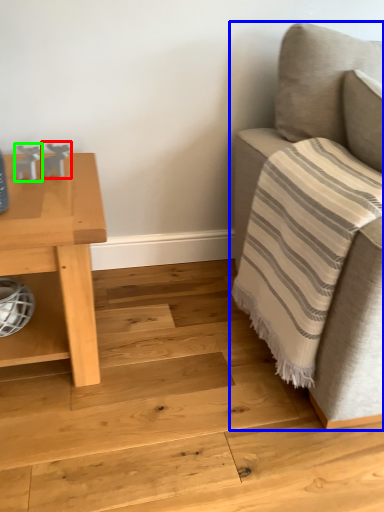
Question: Based on their relative distances, which object is farther from toy (highlighted by a red box)? Choose from studio couch (highlighted by a blue box) and toy (highlighted by a green box).

Choices:
 (A) studio couch
 (B) toy

Answer: (A)